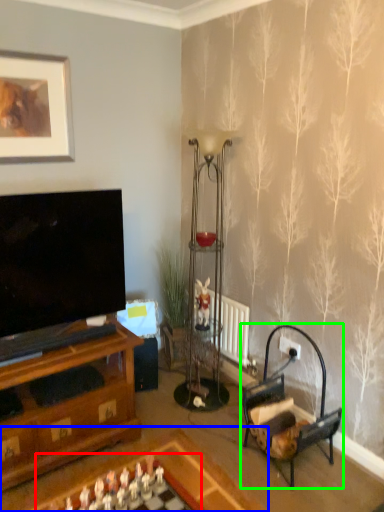
Question: Estimate the real-world distances between objects in this image. Which object is closer to board game (highlighted by a red box), table (highlighted by a blue box) or armchair (highlighted by a green box)?

Choices:
 (A) table
 (B) armchair

Answer: (A)